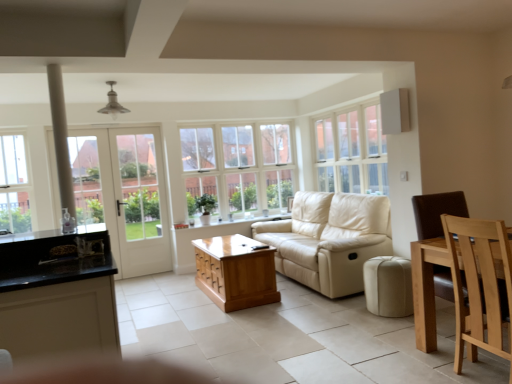
Question: Is beige leather ottoman at lower center to the left of clear glass window at left, arranged as the first window when viewed from the left, from the viewer's perspective?

Choices:
 (A) yes
 (B) no

Answer: (B)

Question: Is beige leather ottoman at lower center completely or partially outside of clear glass window at left, arranged as the first window when viewed from the left?

Choices:
 (A) no
 (B) yes

Answer: (B)

Question: Is beige leather ottoman at lower center in contact with clear glass window at left, arranged as the first window when viewed from the left?

Choices:
 (A) no
 (B) yes

Answer: (A)

Question: From the image's perspective, is beige leather ottoman at lower center located above clear glass window at left, arranged as the first window when viewed from the left?

Choices:
 (A) yes
 (B) no

Answer: (B)

Question: Considering the relative sizes of beige leather ottoman at lower center and clear glass window at left, arranged as the first window when viewed from the left, in the image provided, is beige leather ottoman at lower center bigger than clear glass window at left, arranged as the first window when viewed from the left,?

Choices:
 (A) yes
 (B) no

Answer: (A)

Question: From the image's perspective, is cream leather studio couch at center positioned above or below beige leather ottoman at lower center?

Choices:
 (A) below
 (B) above

Answer: (B)

Question: Is cream leather studio couch at center inside or outside of beige leather ottoman at lower center?

Choices:
 (A) outside
 (B) inside

Answer: (A)

Question: Looking at their shapes, would you say cream leather studio couch at center is wider or thinner than beige leather ottoman at lower center?

Choices:
 (A) wide
 (B) thin

Answer: (A)

Question: From their relative heights in the image, would you say cream leather studio couch at center is taller or shorter than beige leather ottoman at lower center?

Choices:
 (A) short
 (B) tall

Answer: (B)

Question: In terms of width, does clear glass window at left, acting as the third window starting from the right, look wider or thinner when compared to white glass door at left?

Choices:
 (A) thin
 (B) wide

Answer: (B)

Question: Based on their sizes in the image, would you say clear glass window at left, arranged as the first window when viewed from the left, is bigger or smaller than white glass door at left?

Choices:
 (A) small
 (B) big

Answer: (A)

Question: Based on their positions, is clear glass window at left, acting as the third window starting from the right, located to the left or right of white glass door at left?

Choices:
 (A) right
 (B) left

Answer: (B)

Question: Does point (2, 155) appear closer or farther from the camera than point (153, 218)?

Choices:
 (A) closer
 (B) farther

Answer: (A)

Question: From a real-world perspective, relative to beige leather ottoman at lower center, is white wood window at upper center, which is the third window in left-to-right order, vertically above or below?

Choices:
 (A) below
 (B) above

Answer: (B)

Question: Visually, is white wood window at upper center, the 1th window in the right-to-left sequence, positioned to the left or to the right of beige leather ottoman at lower center?

Choices:
 (A) left
 (B) right

Answer: (B)